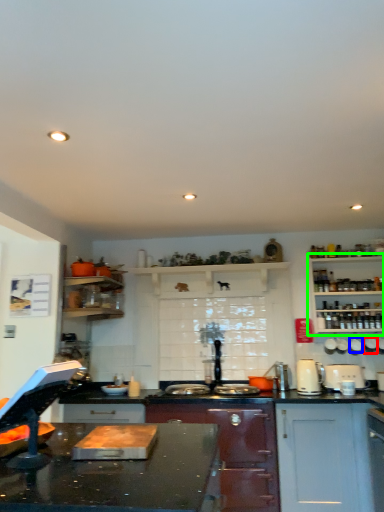
Question: Estimate the real-world distances between objects in this image. Which object is closer to appliance (highlighted by a red box), appliance (highlighted by a blue box) or shelf (highlighted by a green box)?

Choices:
 (A) appliance
 (B) shelf

Answer: (A)